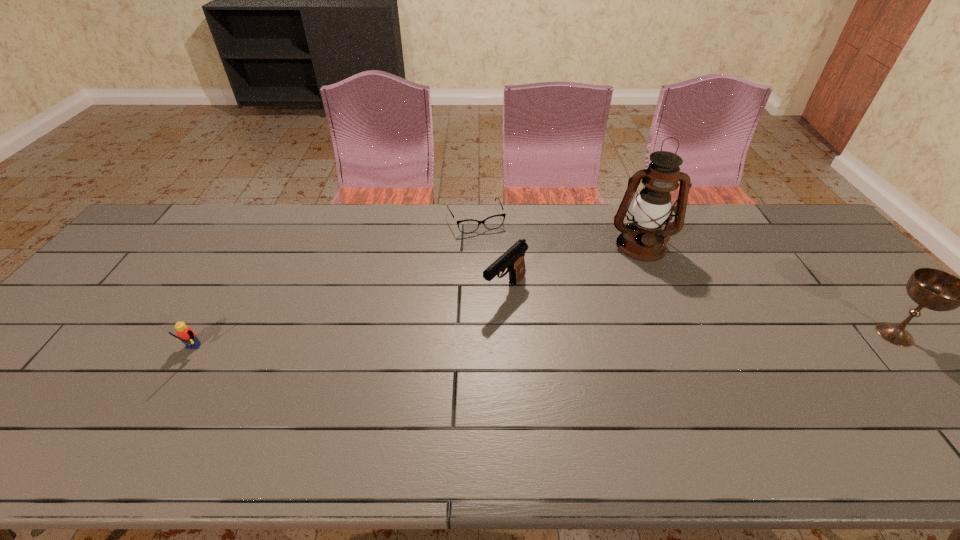
This screenshot has height=540, width=960. What are the coordinates of `Lego` in the screenshot? It's located at (185, 334).

Where is `the leftmost object`? the leftmost object is located at coordinates (185, 334).

The height and width of the screenshot is (540, 960). I want to click on chalice, so click(933, 289).

The height and width of the screenshot is (540, 960). I want to click on the rightmost object, so click(933, 289).

Locate an element on the screen. the fourth object from left to right is located at coordinates (643, 239).

I want to click on lantern, so click(x=643, y=239).

What are the coordinates of `the shortest object` in the screenshot? It's located at (493, 222).

Locate an element on the screen. the third tallest object is located at coordinates (513, 259).

You are a GUI agent. You are given a task and a screenshot of the screen. Output one action in this format:
    pyautogui.click(x=<x>, y=<y>)
    Task: Click on the third nearest object
    
    Given the screenshot: What is the action you would take?
    pyautogui.click(x=513, y=259)

Locate an element on the screen. The image size is (960, 540). free location located on the front-facing side of the second shortest object is located at coordinates (154, 414).